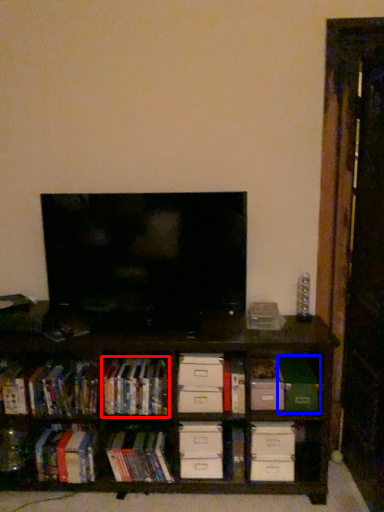
Question: Among these objects, which one is nearest to the camera, book (highlighted by a red box) or paperback book (highlighted by a blue box)?

Choices:
 (A) book
 (B) paperback book

Answer: (A)